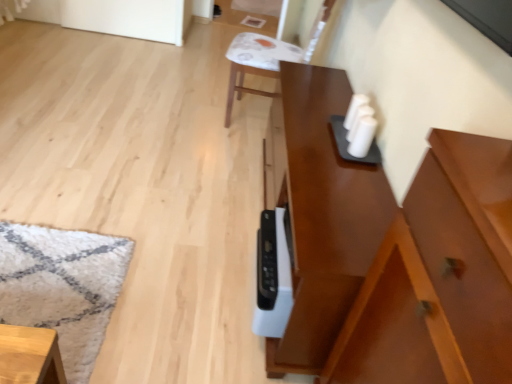
At what (x,y) coordinates should I click in order to perform the action: click on white fabric chair at upper center. Please return your answer as a coordinate pair (x, y). The height and width of the screenshot is (384, 512). Looking at the image, I should click on (272, 55).

This screenshot has height=384, width=512. What do you see at coordinates (272, 55) in the screenshot? I see `white fabric chair at upper center` at bounding box center [272, 55].

Image resolution: width=512 pixels, height=384 pixels. Identify the location of white fabric chair at upper center. (272, 55).